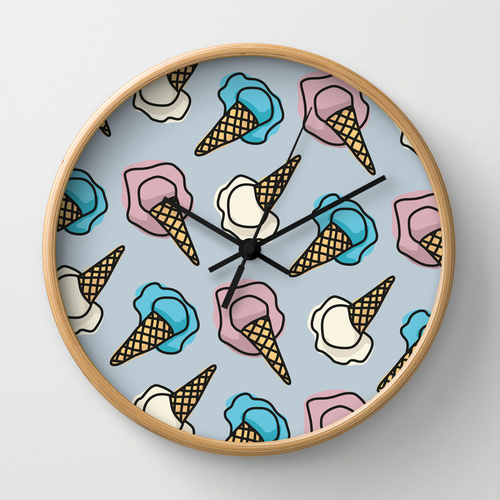
The width and height of the screenshot is (500, 500). I want to click on edge of clock, so click(x=357, y=418).